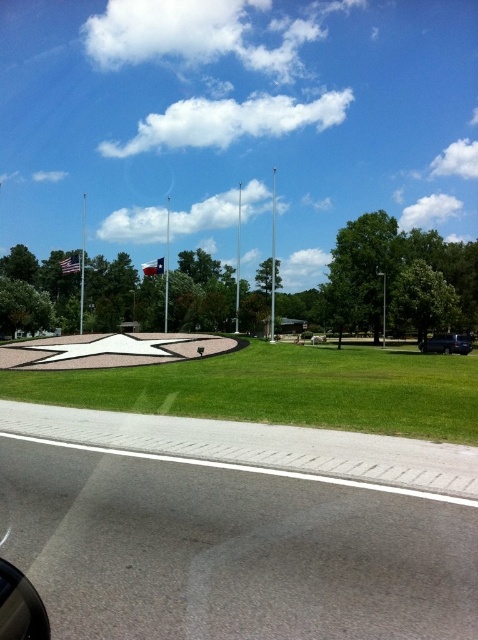
Is transparent glass car window at lower left positioned behind black matte car at lower right?

No, transparent glass car window at lower left is closer to the viewer.

Which is more to the left, transparent glass car window at lower left or black matte car at lower right?

transparent glass car window at lower left is more to the left.

Does point (7, 612) come farther from viewer compared to point (445, 344)?

That is False.

Locate an element on the screen. transparent glass car window at lower left is located at coordinates (21, 605).

Does green grass at center appear on the left side of black matte car at lower right?

Yes, green grass at center is to the left of black matte car at lower right.

Consider the image. Is green grass at center taller than black matte car at lower right?

Indeed, green grass at center has a greater height compared to black matte car at lower right.

Does point (252, 356) come closer to viewer compared to point (466, 337)?

That is True.

Find the location of a particular element. The height and width of the screenshot is (640, 478). green grass at center is located at coordinates (282, 388).

Does green grass at center appear on the left side of transparent glass car window at lower left?

In fact, green grass at center is to the right of transparent glass car window at lower left.

Between point (223, 403) and point (33, 624), which one is positioned in front?

Positioned in front is point (33, 624).

Find the location of a particular element. This screenshot has height=640, width=478. green grass at center is located at coordinates (282, 388).